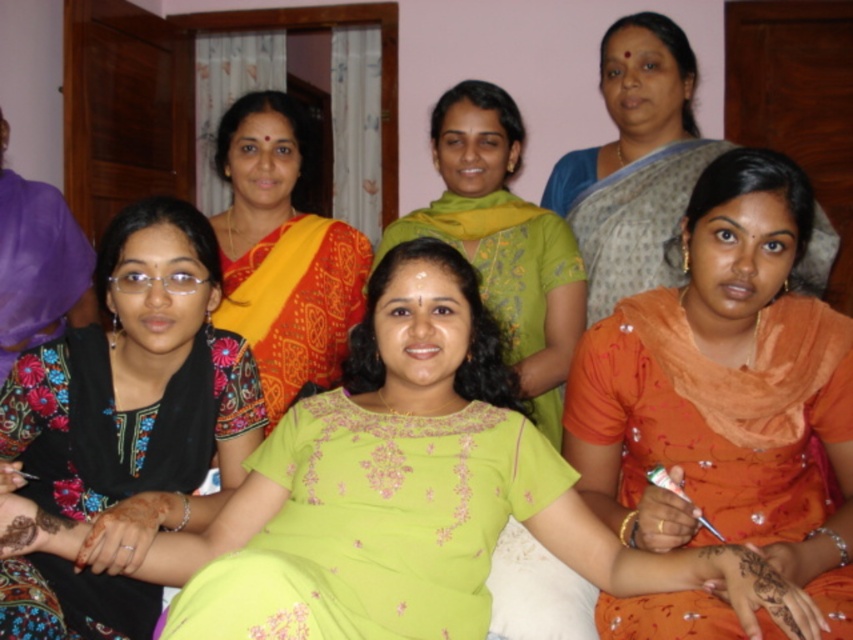
Does point (259, 259) come behind point (497, 333)?

Yes, it is behind point (497, 333).

Is the position of yellow-orange sari at center more distant than that of green embroidered dress at center?

Yes, it is behind green embroidered dress at center.

Is point (294, 340) positioned in front of point (495, 349)?

That is False.

Image resolution: width=853 pixels, height=640 pixels. Identify the location of yellow-orange sari at center. (282, 253).

The image size is (853, 640). What are the coordinates of `floral fabric blouse at center` in the screenshot? It's located at (137, 385).

The height and width of the screenshot is (640, 853). I want to click on floral fabric blouse at center, so pos(137,385).

At what (x,y) coordinates should I click in order to perform the action: click on floral fabric blouse at center. Please return your answer as a coordinate pair (x, y). Image resolution: width=853 pixels, height=640 pixels. Looking at the image, I should click on (x=137, y=385).

Is point (676, 198) positioned after point (554, 400)?

No.

Does matte orange sari at right have a smaller size compared to green embroidered blouse at center?

No.

Is point (670, 257) positioned in front of point (508, 164)?

Yes, it is in front of point (508, 164).

Image resolution: width=853 pixels, height=640 pixels. I want to click on matte orange sari at right, so (634, 163).